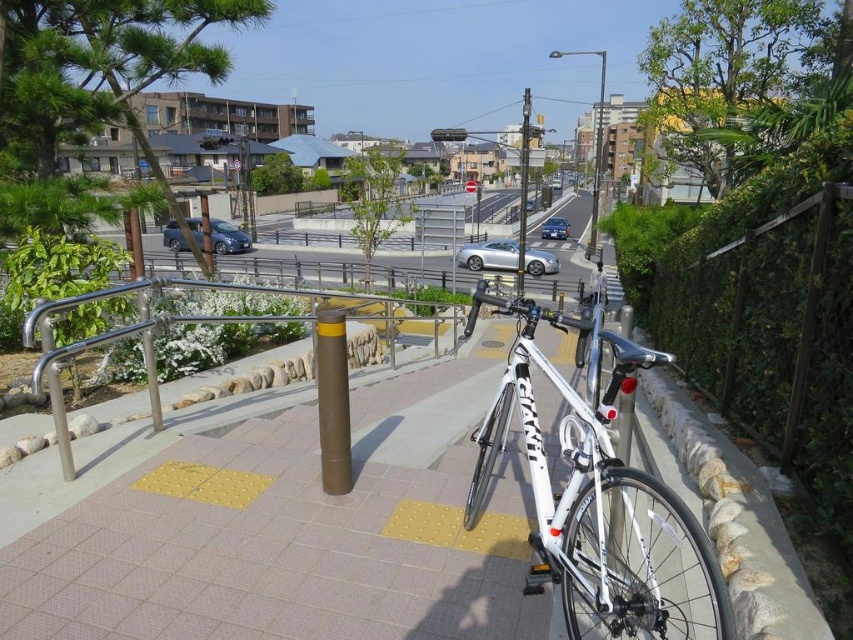
Question: Can you confirm if brown matte pole at center is thinner than silver metallic car at center?

Choices:
 (A) no
 (B) yes

Answer: (B)

Question: Does silver metallic handrail at center appear over metallic gray pole at center?

Choices:
 (A) no
 (B) yes

Answer: (A)

Question: Which is farther from the metallic pole at center?

Choices:
 (A) silver metallic car at center
 (B) white matte bicycle at center
 (C) metallic silver sedan at center

Answer: (B)

Question: Estimate the real-world distances between objects in this image. Which object is closer to the silver metallic sedan at left?

Choices:
 (A) metallic gray pole at center
 (B) metallic pole at center
 (C) silver metallic handrail at center
 (D) brown matte pole at center

Answer: (C)

Question: Is metallic pole at center wider than metallic silver sedan at center?

Choices:
 (A) yes
 (B) no

Answer: (A)

Question: Considering the real-world distances, which object is farthest from the silver metallic car at center?

Choices:
 (A) metallic silver sedan at center
 (B) metallic pole at center

Answer: (A)